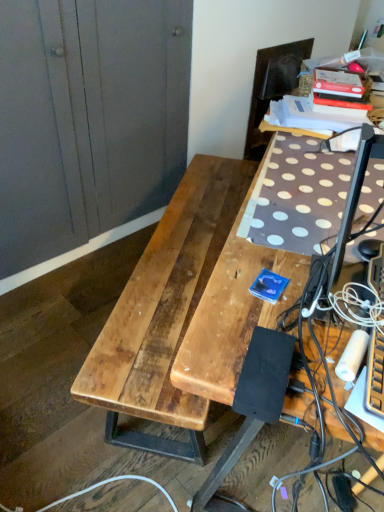
Question: From a real-world perspective, is black rubber extension cord at lower right beneath natural wood table at center?

Choices:
 (A) yes
 (B) no

Answer: (A)

Question: Could natural wood table at center be considered to be inside black rubber extension cord at lower right?

Choices:
 (A) yes
 (B) no

Answer: (B)

Question: Is natural wood table at center at the back of black rubber extension cord at lower right?

Choices:
 (A) no
 (B) yes

Answer: (A)

Question: Is black rubber extension cord at lower right located outside natural wood table at center?

Choices:
 (A) no
 (B) yes

Answer: (B)

Question: Could you tell me if black rubber extension cord at lower right is facing natural wood table at center?

Choices:
 (A) yes
 (B) no

Answer: (B)

Question: From the image's perspective, relative to wooden dresser at left, is brown wooden desk at center above or below?

Choices:
 (A) above
 (B) below

Answer: (B)

Question: Considering the positions of brown wooden desk at center and wooden dresser at left in the image, is brown wooden desk at center bigger or smaller than wooden dresser at left?

Choices:
 (A) big
 (B) small

Answer: (A)

Question: From a real-world perspective, relative to wooden dresser at left, is brown wooden desk at center vertically above or below?

Choices:
 (A) above
 (B) below

Answer: (B)

Question: In terms of width, does brown wooden desk at center look wider or thinner when compared to wooden dresser at left?

Choices:
 (A) thin
 (B) wide

Answer: (B)

Question: Is natural wood table at center wider or thinner than wooden dresser at left?

Choices:
 (A) thin
 (B) wide

Answer: (A)

Question: Is natural wood table at center inside or outside of wooden dresser at left?

Choices:
 (A) outside
 (B) inside

Answer: (A)

Question: Based on their sizes in the image, would you say natural wood table at center is bigger or smaller than wooden dresser at left?

Choices:
 (A) small
 (B) big

Answer: (A)

Question: Is natural wood table at center taller or shorter than wooden dresser at left?

Choices:
 (A) short
 (B) tall

Answer: (A)

Question: Looking at their shapes, would you say black rubber extension cord at lower right is wider or thinner than dark brown leather swivel chair at upper right?

Choices:
 (A) thin
 (B) wide

Answer: (A)

Question: In the image, is black rubber extension cord at lower right positioned in front of or behind dark brown leather swivel chair at upper right?

Choices:
 (A) front
 (B) behind

Answer: (A)